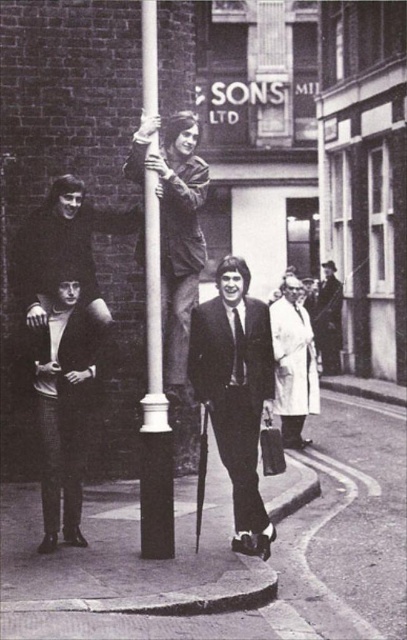
You are standing on the sidewalk in the scene and want to reach the white glossy pole at center without moving the leather jacket at upper center. Which direction should you move?

You should move forward because the white glossy pole at center is behind the leather jacket at upper center, so moving forward past the leather jacket at upper center will allow you to reach the white glossy pole at center.

You are a photographer trying to capture a clear shot of both the white glossy pole at center and the smooth black suit at lower left. Since you want both subjects to be in focus, you need to adjust your camera settings. Based on their positions, which subject is closer to the camera?

The white glossy pole at center is closer to the camera than the smooth black suit at lower left because it is positioned in front of it.